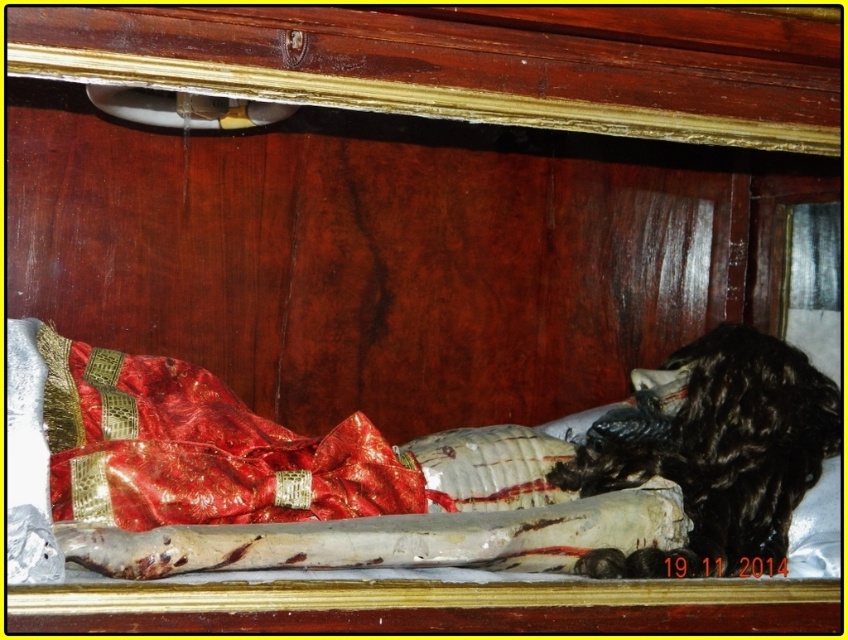
Based on the photo, you are an interior designer planning to place a new decorative item between the red satin bed at center and the black fur animal at right. To ensure proper spacing, you need to know which object is wider. Can you determine which one is wider?

The red satin bed at center is wider than the black fur animal at right according to the description.

You are an archaeologist examining the interior of the wooden sarcophagus. You notice two points marked inside the case. From your perspective outside the sarcophagus, which point is closer to you, point (611, 497) or point (416, 483)?

Point (611, 497) is in front of point (416, 483), so it is closer to you.

You are an archaeologist examining the wooden sarcophagus. You need to determine the spatial relationship between the red satin bed at center and the black fur animal at right. Which object is closer to the front of the sarcophagus?

The red satin bed at center is closer to the front of the sarcophagus than the black fur animal at right because it is positioned in front of it.